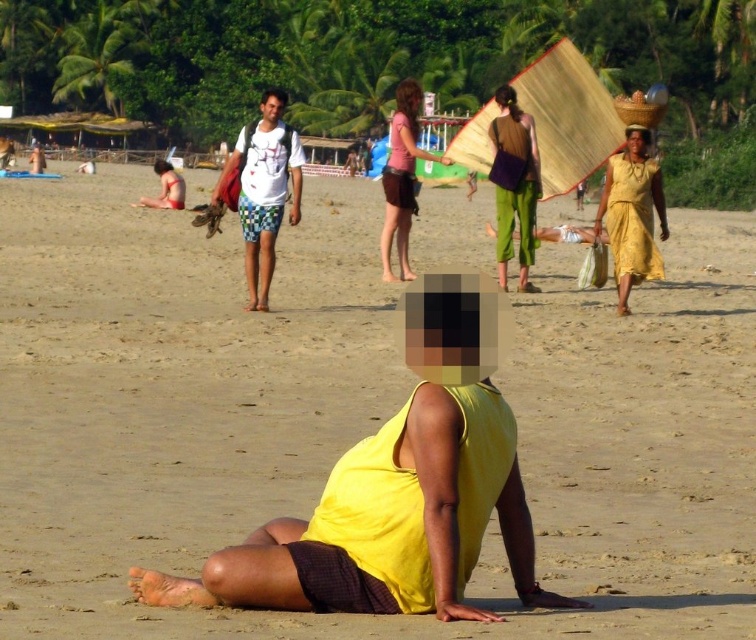
Question: Can you confirm if white printed t-shirt at center is wider than red swimsuit at left?

Choices:
 (A) no
 (B) yes

Answer: (A)

Question: Which is nearer to the red swimsuit at left?

Choices:
 (A) white printed t-shirt at center
 (B) matte brown bag at center
 (C) matte pink tank top at center
 (D) yellow fabric dress at right

Answer: (B)

Question: Can you confirm if yellow fabric dress at right is bigger than red swimsuit at left?

Choices:
 (A) yes
 (B) no

Answer: (B)

Question: Based on their relative distances, which object is nearer to the yellow fabric dress at right?

Choices:
 (A) white printed t-shirt at center
 (B) red swimsuit at left
 (C) matte brown bag at center
 (D) matte pink tank top at center

Answer: (C)

Question: Can you confirm if white printed t-shirt at center is positioned below red swimsuit at left?

Choices:
 (A) no
 (B) yes

Answer: (B)

Question: Among these objects, which one is farthest from the camera?

Choices:
 (A) matte pink tank top at center
 (B) red swimsuit at left

Answer: (B)